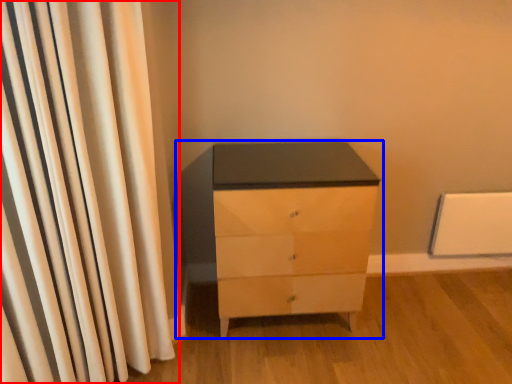
Question: Among these objects, which one is nearest to the camera, curtain (highlighted by a red box) or chest of drawers (highlighted by a blue box)?

Choices:
 (A) curtain
 (B) chest of drawers

Answer: (A)